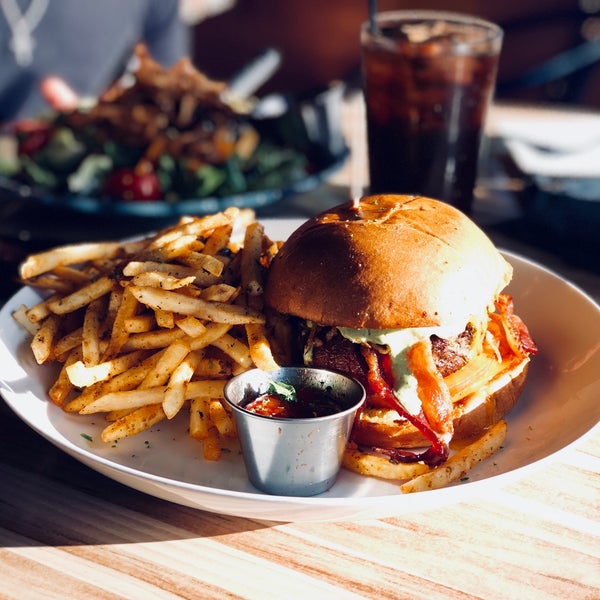
I want to click on plate, so click(182, 476), click(152, 212).